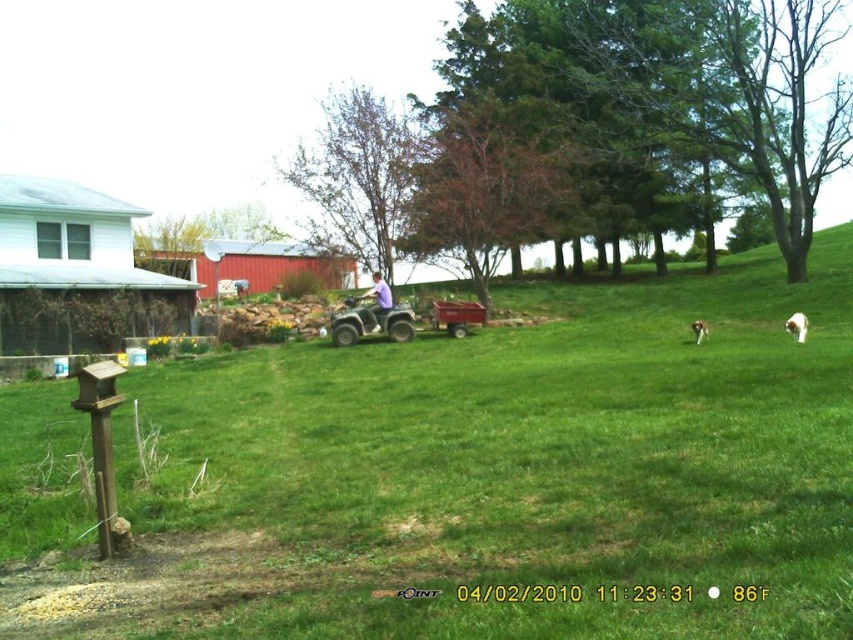
Is green grass at center smaller than white fluffy dog at right?

No.

Between point (598, 600) and point (801, 316), which one is positioned behind?

The point (801, 316) is behind.

Is point (281, 611) farther from viewer compared to point (796, 332)?

No, it is in front of (796, 332).

Image resolution: width=853 pixels, height=640 pixels. What are the coordinates of `green grass at center` in the screenshot? It's located at (498, 476).

Is point (375, 312) less distant than point (699, 342)?

No.

Is green matte/soft tractor at center taller than white fur dog at lower right?

Yes.

This screenshot has width=853, height=640. In order to click on green matte/soft tractor at center in this screenshot , I will do 369,321.

Is the position of green matte/soft tractor at center less distant than that of white fluffy dog at right?

No, green matte/soft tractor at center is further to the viewer.

Who is higher up, green matte/soft tractor at center or white fluffy dog at right?

green matte/soft tractor at center is higher up.

What do you see at coordinates (369, 321) in the screenshot? The height and width of the screenshot is (640, 853). I see `green matte/soft tractor at center` at bounding box center [369, 321].

Locate an element on the screen. The height and width of the screenshot is (640, 853). green matte/soft tractor at center is located at coordinates (369, 321).